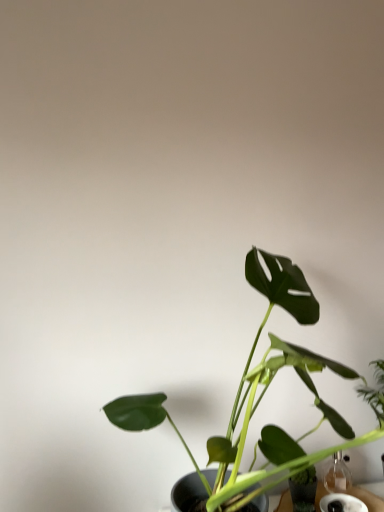
Where is `green matte leafy plant at center`? This screenshot has width=384, height=512. green matte leafy plant at center is located at coordinates (260, 394).

From the picture: Measure the distance between green matte leafy plant at center and camera.

green matte leafy plant at center and camera are 24.76 inches apart.

Describe the element at coordinates (260, 394) in the screenshot. I see `green matte leafy plant at center` at that location.

In order to click on transparent glass vase at lower right in this screenshot , I will do `click(303, 490)`.

Measure the distance between point (306, 500) and camera.

A distance of 38.90 inches exists between point (306, 500) and camera.

The image size is (384, 512). Describe the element at coordinates (303, 490) in the screenshot. I see `transparent glass vase at lower right` at that location.

Identify the location of green matte leafy plant at center. The image size is (384, 512). (260, 394).

Visually, is transparent glass vase at lower right positioned to the left or to the right of green matte leafy plant at center?

Based on their positions, transparent glass vase at lower right is located to the right of green matte leafy plant at center.

Is transparent glass vase at lower right behind green matte leafy plant at center?

Yes.

Which is in front, point (307, 507) or point (280, 448)?

The point (280, 448) is closer.

From the image's perspective, between transparent glass vase at lower right and green matte leafy plant at center, which one is located above?

green matte leafy plant at center is shown above in the image.

From a real-world perspective, is transparent glass vase at lower right positioned above or below green matte leafy plant at center?

transparent glass vase at lower right is situated lower than green matte leafy plant at center in the real world.

Looking at their sizes, would you say transparent glass vase at lower right is wider or thinner than green matte leafy plant at center?

Considering their sizes, transparent glass vase at lower right looks slimmer than green matte leafy plant at center.

Between transparent glass vase at lower right and green matte leafy plant at center, which one has more height?

green matte leafy plant at center.

Is transparent glass vase at lower right bigger than green matte leafy plant at center?

No.

Is transparent glass vase at lower right not within green matte leafy plant at center?

No.

Would you consider transparent glass vase at lower right to be distant from green matte leafy plant at center?

They are positioned close to each other.

Is transparent glass vase at lower right positioned with its back to green matte leafy plant at center?

Absolutely, transparent glass vase at lower right is directed away from green matte leafy plant at center.

How distant is transparent glass vase at lower right from green matte leafy plant at center?

They are 11.36 inches apart.

In the image, there is a transparent glass vase at lower right. Where is `houseplant above it (from the image's perspective)`? This screenshot has height=512, width=384. houseplant above it (from the image's perspective) is located at coordinates (260, 394).

Between green matte leafy plant at center and transparent glass vase at lower right, which one appears on the left side from the viewer's perspective?

Positioned to the left is green matte leafy plant at center.

Does green matte leafy plant at center lie in front of transparent glass vase at lower right?

Yes.

Does point (256, 345) appear closer or farther from the camera than point (306, 480)?

Point (256, 345) is farther from the camera than point (306, 480).

From the image's perspective, is green matte leafy plant at center below transparent glass vase at lower right?

Actually, green matte leafy plant at center appears above transparent glass vase at lower right in the image.

From a real-world perspective, is green matte leafy plant at center physically located above or below transparent glass vase at lower right?

In terms of real-world spatial position, green matte leafy plant at center is above transparent glass vase at lower right.

Does green matte leafy plant at center have a lesser width compared to transparent glass vase at lower right?

No.

Between green matte leafy plant at center and transparent glass vase at lower right, which one has more height?

green matte leafy plant at center is taller.

Considering the relative sizes of green matte leafy plant at center and transparent glass vase at lower right in the image provided, is green matte leafy plant at center bigger than transparent glass vase at lower right?

Yes.

Is green matte leafy plant at center inside or outside of transparent glass vase at lower right?

green matte leafy plant at center lies outside transparent glass vase at lower right.

Is the surface of green matte leafy plant at center in direct contact with transparent glass vase at lower right?

There is a gap between green matte leafy plant at center and transparent glass vase at lower right.

Is green matte leafy plant at center oriented towards transparent glass vase at lower right?

No, green matte leafy plant at center is not oriented towards transparent glass vase at lower right.

The image size is (384, 512). In order to click on houseplant that is above the transparent glass vase at lower right (from a real-world perspective) in this screenshot , I will do `click(260, 394)`.

The width and height of the screenshot is (384, 512). Find the location of `houseplant that is on the left side of transparent glass vase at lower right`. houseplant that is on the left side of transparent glass vase at lower right is located at coordinates (260, 394).

You are a GUI agent. You are given a task and a screenshot of the screen. Output one action in this format:
    pyautogui.click(x=<x>, y=<y>)
    Task: Click on the glass vase on the right of green matte leafy plant at center
    The width and height of the screenshot is (384, 512).
    Given the screenshot: What is the action you would take?
    pyautogui.click(x=303, y=490)